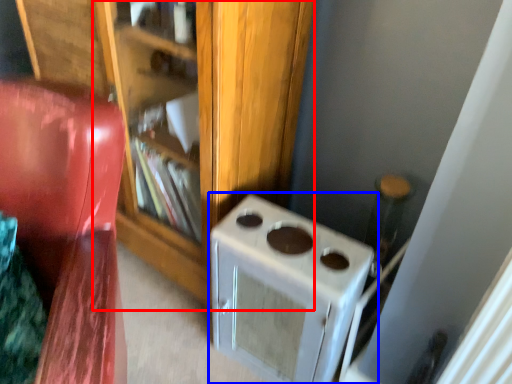
Question: Which object appears farthest to the camera in this image, bookshelf (highlighted by a red box) or home appliance (highlighted by a blue box)?

Choices:
 (A) bookshelf
 (B) home appliance

Answer: (B)